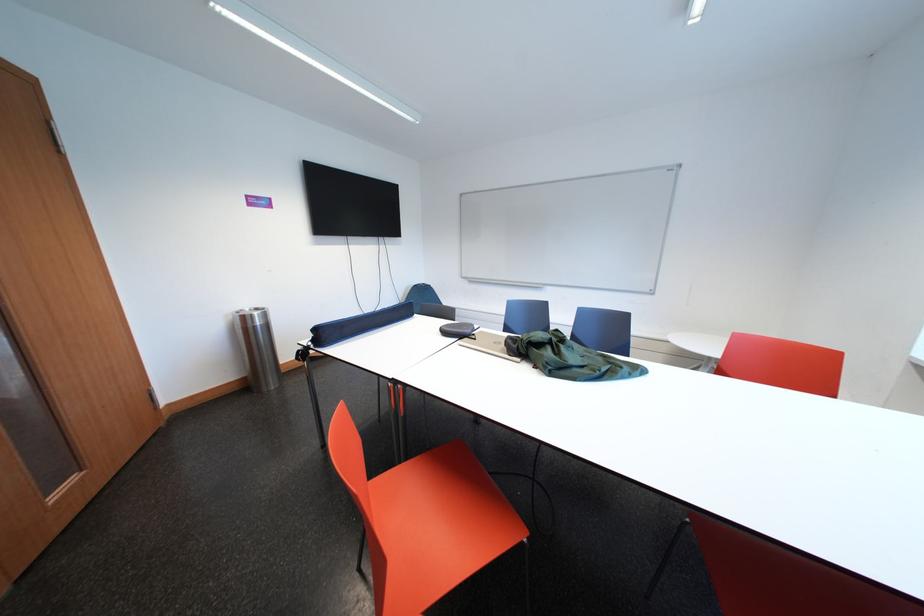
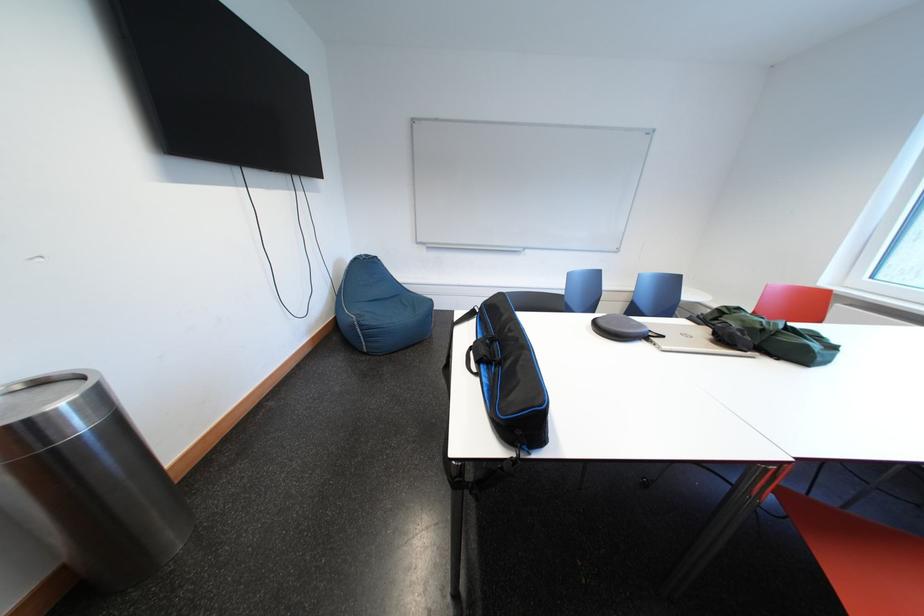
Find the pixel in the second image that matches point 469,339 in the first image.

(657, 341)